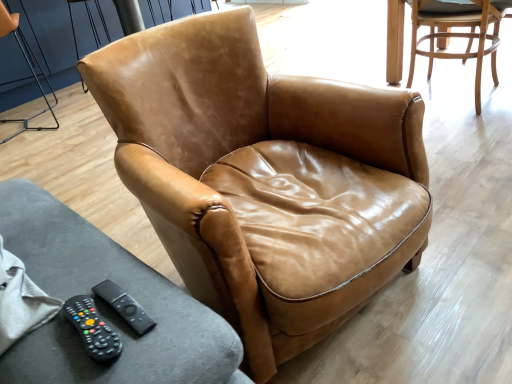
Question: In terms of size, does black rubber remote at lower left, placed as the first remote when sorted from back to front, appear bigger or smaller than brown leather armchair at upper center, which is counted as the 1th chair, starting from the left?

Choices:
 (A) small
 (B) big

Answer: (A)

Question: Is black rubber remote at lower left, the second remote in the front-to-back sequence, spatially inside brown leather armchair at upper center, which appears as the 3th chair when viewed from the right, or outside of it?

Choices:
 (A) outside
 (B) inside

Answer: (A)

Question: Which object is positioned closest to the black rubber remote at lower left, the 2th remote viewed from the back?

Choices:
 (A) light brown leather chair at upper right, positioned as the 3th chair in left-to-right order
 (B) brown leather armchair at upper center, which is counted as the 1th chair, starting from the left
 (C) black rubber remote at lower left, placed as the first remote when sorted from back to front
 (D) cognac leather armchair at center, the second chair viewed from the left

Answer: (C)

Question: Estimate the real-world distances between objects in this image. Which object is closer to the light brown leather chair at upper right, which is the 1th chair in right-to-left order?

Choices:
 (A) cognac leather armchair at center, the second chair viewed from the left
 (B) black rubber remote at lower left, the second remote in the front-to-back sequence
 (C) black rubber remote at lower left, which is the first remote from front to back
 (D) brown leather armchair at upper center, which is counted as the 1th chair, starting from the left

Answer: (A)